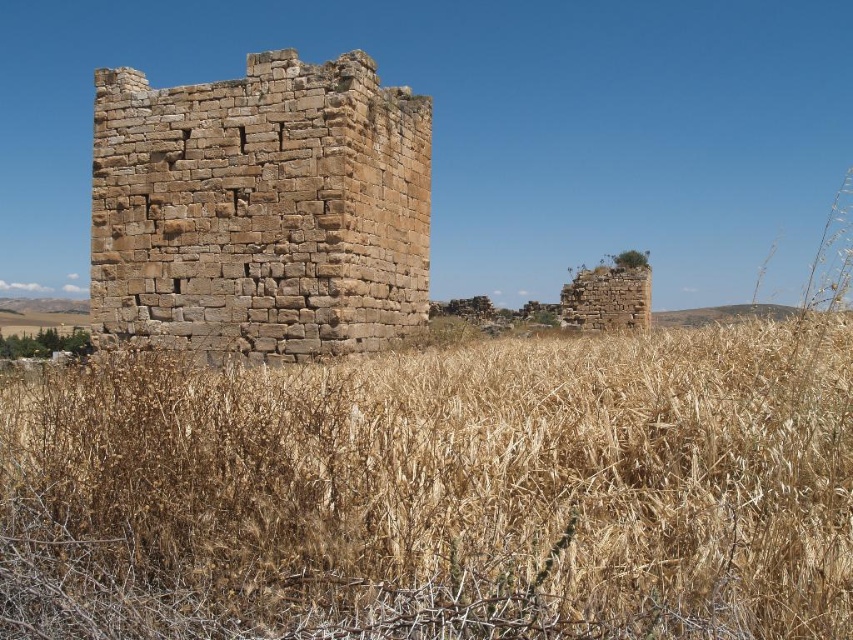
Does brown dry grass at center appear under brown stone ruins at center?

Indeed, brown dry grass at center is positioned under brown stone ruins at center.

Locate an element on the screen. brown dry grass at center is located at coordinates (439, 492).